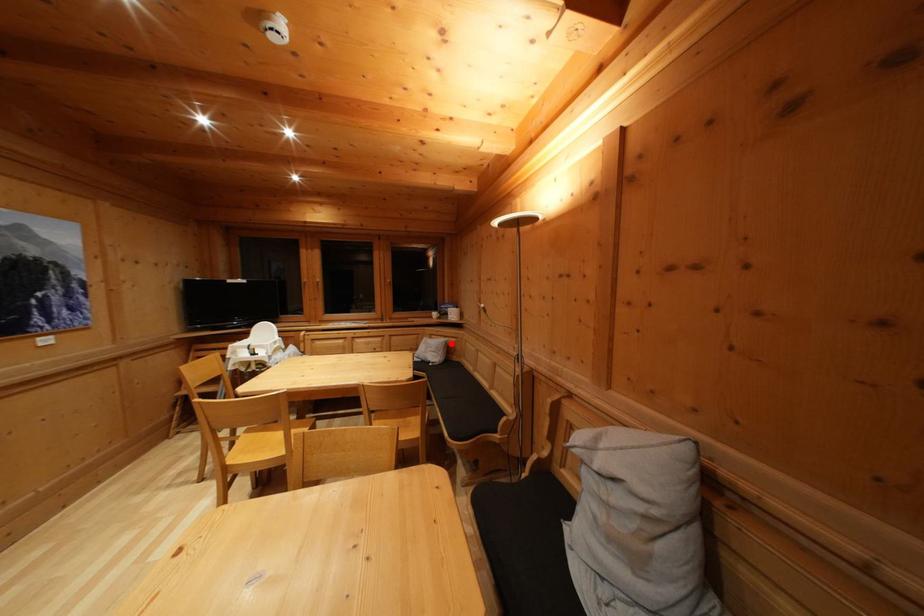
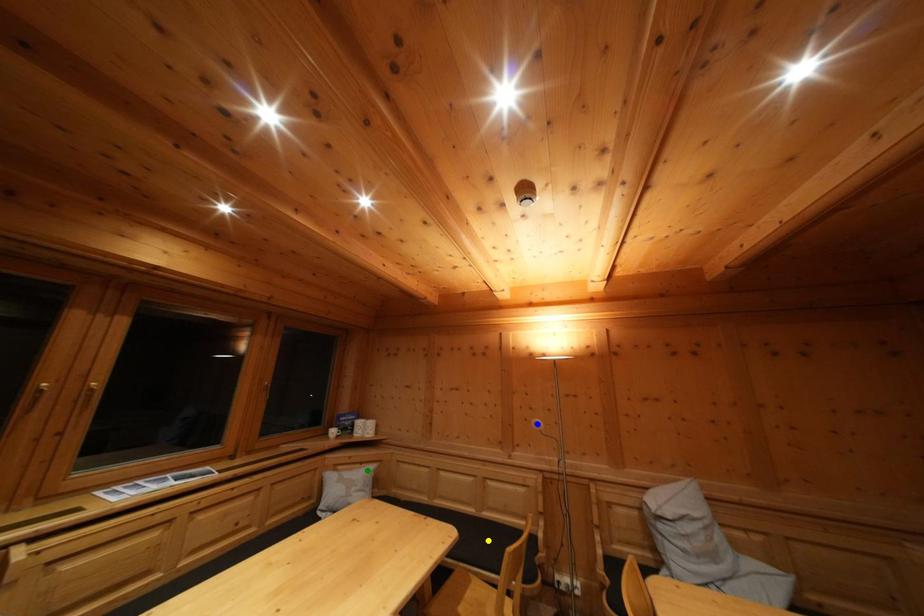
Question: I am providing you with two images of the same scene from different viewpoints. A red point is marked on the first image. You are given multiple points on the second image. Which point in image 2 is actually the same real-world point as the red point in image 1?

Choices:
 (A) yellow point
 (B) blue point
 (C) green point

Answer: (C)